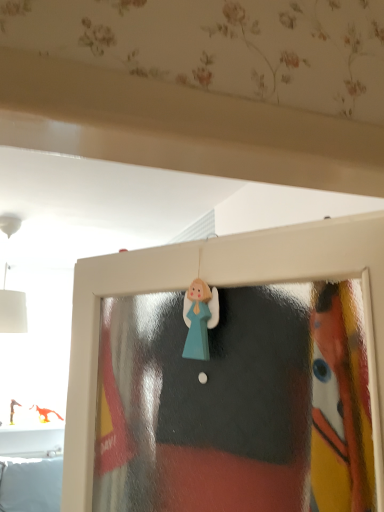
What is the approximate width of white fabric pillow at lower left?

The width of white fabric pillow at lower left is 9.16 inches.

Image resolution: width=384 pixels, height=512 pixels. Identify the location of white fabric pillow at lower left. (32, 486).

What do you see at coordinates (32, 486) in the screenshot? I see `white fabric pillow at lower left` at bounding box center [32, 486].

Where is `white fabric pillow at lower left`? This screenshot has height=512, width=384. white fabric pillow at lower left is located at coordinates (32, 486).